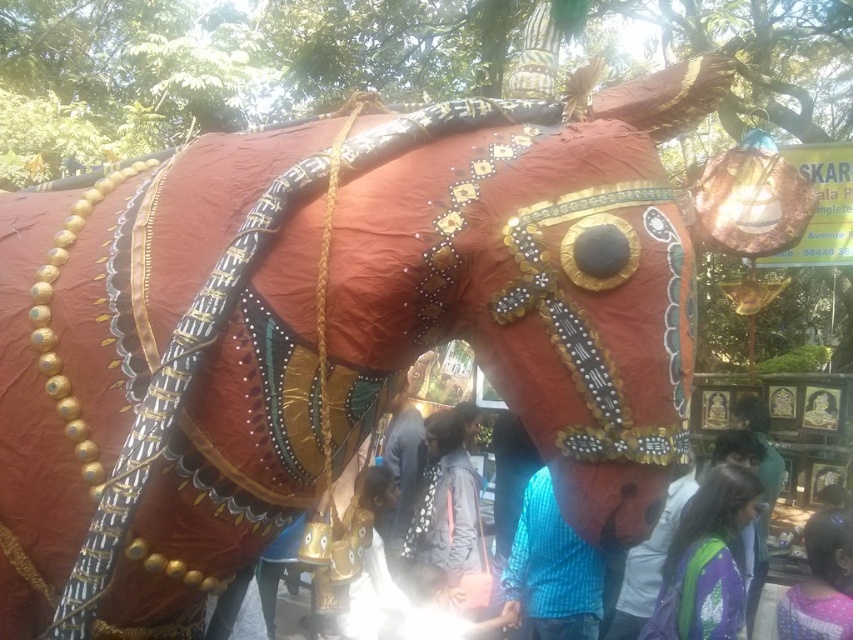
You are standing in front of the horse statue and want to find a person wearing a blue checkered shirt at center. Where should you look?

You should look at point (552, 570) to find the blue checkered shirt at center.

You are a photographer standing in the crowd at this event. You want to take a photo that includes both the blue checkered shirt at center and the purple fabric at lower right. How far apart are these two items in the image?

The blue checkered shirt at center is 96.70 centimeters from the purple fabric at lower right, so they are approximately 96.70 centimeters apart in the image.